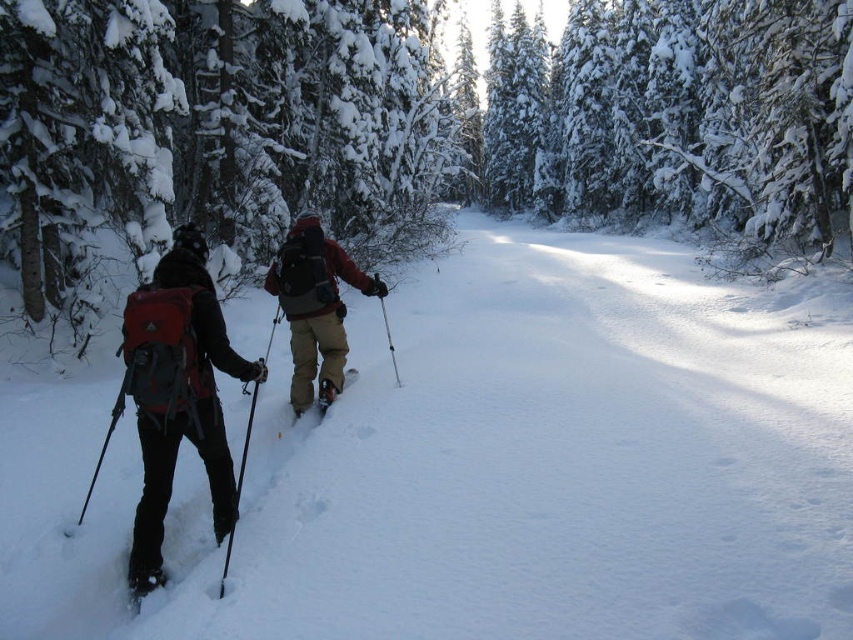
You are planning to choose a ski pole for your snowshoeing trip based on the image. If you need a wider pole for better grip, which one between the matte black ski pole at left and the metallic silver ski pole at center should you pick?

The metallic silver ski pole at center has a greater width than the matte black ski pole at left, so you should pick the metallic silver ski pole at center for better grip.

You are a photographer trying to capture a closeup of the metallic silver ski pole at center without the matte black ski pole at left appearing in the frame. Can you position yourself in a way to achieve this?

The matte black ski pole at left is positioned on the left side of the metallic silver ski pole at center. To avoid including the matte black ski pole at left in the frame, position yourself to the right side of the metallic silver ski pole at center so that the matte black ski pole at left is out of the camera view.